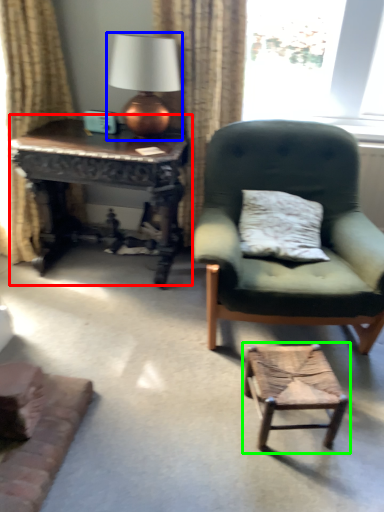
Question: Which is farther away from nightstand (highlighted by a red box)? table lamp (highlighted by a blue box) or stool (highlighted by a green box)?

Choices:
 (A) table lamp
 (B) stool

Answer: (B)